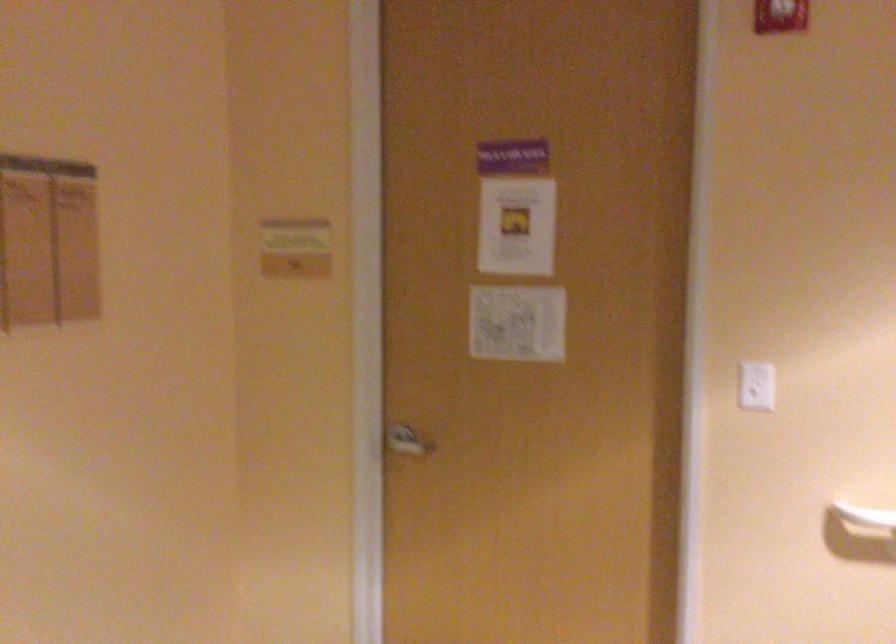
Where is `white wall handrail`? This screenshot has height=644, width=896. white wall handrail is located at coordinates (865, 518).